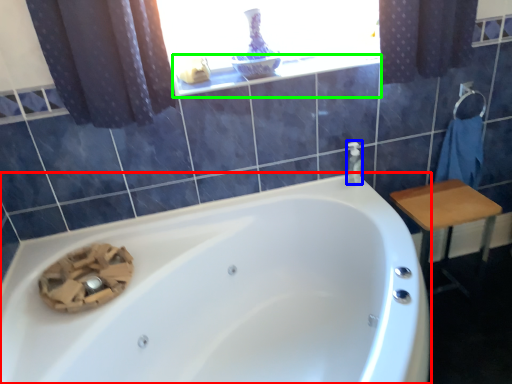
Question: Which is farther away from bathtub (highlighted by a red box)? soap dispenser (highlighted by a blue box) or window sill (highlighted by a green box)?

Choices:
 (A) soap dispenser
 (B) window sill

Answer: (B)